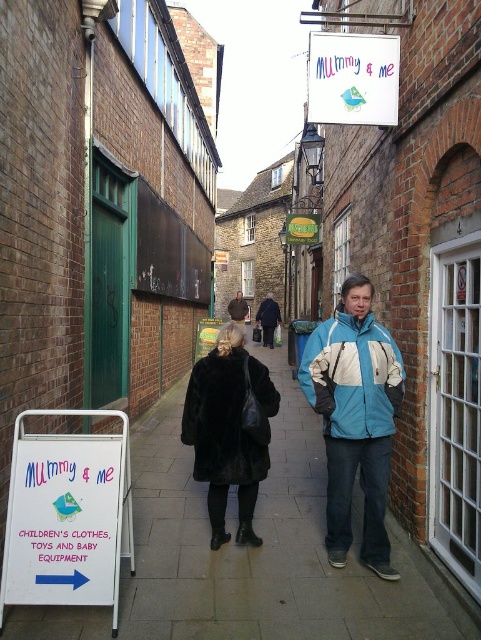
You are a delivery person carrying a large package and need to walk through the narrow alleyway. The alley has a smooth concrete pavement at center and a black fur coat at center. Which object is closer to you as you walk towards the alley entrance?

The smooth concrete pavement at center is closer to the viewer than the black fur coat at center, so the smooth concrete pavement at center would be closer to you as you walk towards the alley entrance.